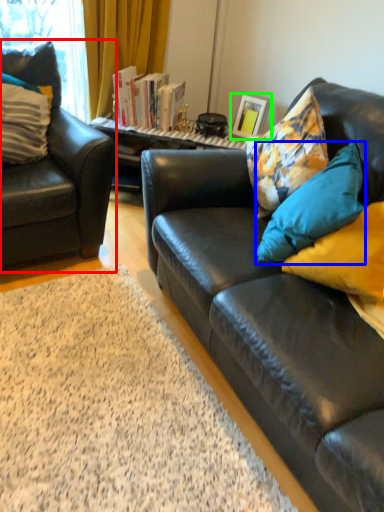
Question: Estimate the real-world distances between objects in this image. Which object is closer to chair (highlighted by a red box), pillow (highlighted by a blue box) or picture frame (highlighted by a green box)?

Choices:
 (A) pillow
 (B) picture frame

Answer: (B)